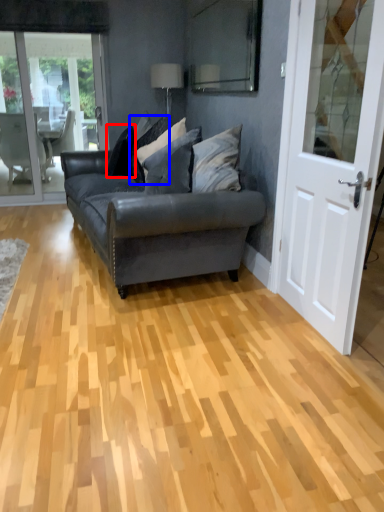
Question: Which object is closer to the camera taking this photo, pillow (highlighted by a red box) or pillow (highlighted by a blue box)?

Choices:
 (A) pillow
 (B) pillow

Answer: (B)